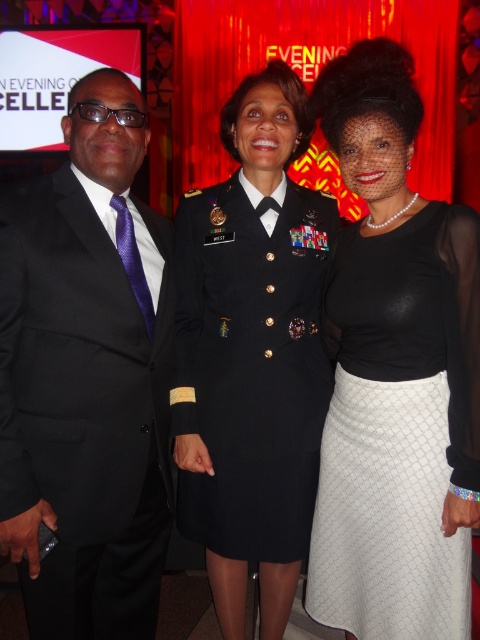
Does shiny black dress at center have a larger size compared to white textured skirt at right?

Yes.

Image resolution: width=480 pixels, height=640 pixels. What do you see at coordinates (252, 353) in the screenshot?
I see `shiny black dress at center` at bounding box center [252, 353].

Where is `shiny black dress at center`? The height and width of the screenshot is (640, 480). shiny black dress at center is located at coordinates (252, 353).

Is black satin suit at left taller than white textured skirt at right?

Correct, black satin suit at left is much taller as white textured skirt at right.

From the picture: Is black satin suit at left above white textured skirt at right?

Yes.

Which is in front, point (6, 417) or point (382, 376)?

Positioned in front is point (6, 417).

Find the location of a particular element. black satin suit at left is located at coordinates (86, 376).

What are the coordinates of `black satin suit at left` in the screenshot? It's located at (86, 376).

Can you confirm if black satin suit at left is bigger than shiny black dress at center?

Indeed, black satin suit at left has a larger size compared to shiny black dress at center.

What are the coordinates of `black satin suit at left` in the screenshot? It's located at (86, 376).